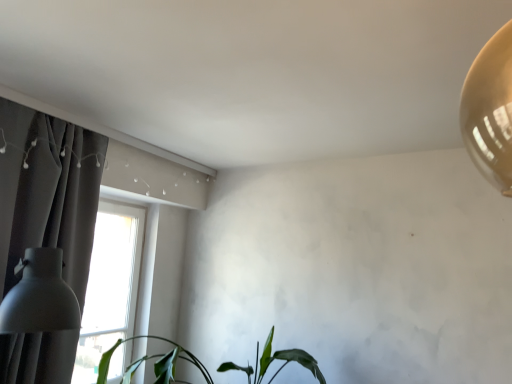
Where is `matte white lampshade at left`? The image size is (512, 384). matte white lampshade at left is located at coordinates (40, 297).

In order to click on dark gray fabric curtain at left in this screenshot , I will do [x=48, y=191].

At what (x,y) coordinates should I click in order to perform the action: click on matte white lampshade at left. Please return your answer as a coordinate pair (x, y). Looking at the image, I should click on (40, 297).

What's the angular difference between green matte plant at lower center and dark gray fabric curtain at left's facing directions?

They differ by 86.9 degrees in their facing directions.

Consider the image. Is green matte plant at lower center directly adjacent to dark gray fabric curtain at left?

green matte plant at lower center and dark gray fabric curtain at left are clearly separated.

The height and width of the screenshot is (384, 512). In order to click on houseplant to the right of dark gray fabric curtain at left in this screenshot , I will do `click(154, 364)`.

Looking at this image, is green matte plant at lower center positioned far away from matte white lampshade at left?

That's right, there is a large distance between green matte plant at lower center and matte white lampshade at left.

Is green matte plant at lower center aimed at matte white lampshade at left?

Yes, green matte plant at lower center is aimed at matte white lampshade at left.

Looking at this image, considering the sizes of green matte plant at lower center and matte white lampshade at left in the image, is green matte plant at lower center taller or shorter than matte white lampshade at left?

Clearly, green matte plant at lower center is shorter compared to matte white lampshade at left.

Is green matte plant at lower center positioned beyond the bounds of matte white lampshade at left?

Absolutely, green matte plant at lower center is external to matte white lampshade at left.

Is matte white lampshade at left oriented away from dark gray fabric curtain at left?

Yes, dark gray fabric curtain at left is at the back of matte white lampshade at left.

Considering the sizes of matte white lampshade at left and dark gray fabric curtain at left in the image, is matte white lampshade at left wider or thinner than dark gray fabric curtain at left?

In the image, matte white lampshade at left appears to be wider than dark gray fabric curtain at left.

Where is `curtain behind the matte white lampshade at left`? This screenshot has height=384, width=512. curtain behind the matte white lampshade at left is located at coordinates (48, 191).

Is matte white lampshade at left wider or thinner than green matte plant at lower center?

Considering their sizes, matte white lampshade at left looks slimmer than green matte plant at lower center.

Is matte white lampshade at left completely or partially outside of green matte plant at lower center?

That's correct, matte white lampshade at left is outside of green matte plant at lower center.

Does matte white lampshade at left have a smaller size compared to green matte plant at lower center?

Yes, matte white lampshade at left is smaller than green matte plant at lower center.

Which is behind, point (37, 297) or point (228, 364)?

The point (228, 364) is more distant.

From the picture: In terms of width, does dark gray fabric curtain at left look wider or thinner when compared to green matte plant at lower center?

In the image, dark gray fabric curtain at left appears to be more narrow than green matte plant at lower center.

From a real-world perspective, is dark gray fabric curtain at left on top of green matte plant at lower center?

Correct, in the physical world, dark gray fabric curtain at left is higher than green matte plant at lower center.

Who is more distant, dark gray fabric curtain at left or green matte plant at lower center?

Positioned behind is green matte plant at lower center.

Find the location of a particular element. The width and height of the screenshot is (512, 384). curtain located above the green matte plant at lower center (from a real-world perspective) is located at coordinates (48, 191).

From the image's perspective, does dark gray fabric curtain at left appear higher than matte white lampshade at left?

Yes, from the image's perspective, dark gray fabric curtain at left is over matte white lampshade at left.

Based on their positions, is dark gray fabric curtain at left located to the left or right of matte white lampshade at left?

Clearly, dark gray fabric curtain at left is on the left of matte white lampshade at left in the image.

Is dark gray fabric curtain at left inside or outside of matte white lampshade at left?

dark gray fabric curtain at left is outside matte white lampshade at left.

You are a GUI agent. You are given a task and a screenshot of the screen. Output one action in this format:
    pyautogui.click(x=<x>, y=<y>)
    Task: Click on the houseplant below the dark gray fabric curtain at left (from the image's perspective)
    Image resolution: width=512 pixels, height=384 pixels.
    Given the screenshot: What is the action you would take?
    pyautogui.click(x=154, y=364)

The width and height of the screenshot is (512, 384). In the image, there is a green matte plant at lower center. Find the location of `table lamp above it (from the image's perspective)`. table lamp above it (from the image's perspective) is located at coordinates pyautogui.click(x=40, y=297).

Based on their spatial positions, is dark gray fabric curtain at left or green matte plant at lower center further from matte white lampshade at left?

green matte plant at lower center lies further to matte white lampshade at left than the other object.

Estimate the real-world distances between objects in this image. Which object is further from dark gray fabric curtain at left, green matte plant at lower center or matte white lampshade at left?

Among the two, green matte plant at lower center is located further to dark gray fabric curtain at left.

From the image, which object appears to be nearer to matte white lampshade at left, green matte plant at lower center or dark gray fabric curtain at left?

Based on the image, dark gray fabric curtain at left appears to be nearer to matte white lampshade at left.

Looking at the image, which one is located closer to green matte plant at lower center, matte white lampshade at left or dark gray fabric curtain at left?

Answer: The object closer to green matte plant at lower center is matte white lampshade at left.

Considering their positions, is matte white lampshade at left positioned closer to dark gray fabric curtain at left than green matte plant at lower center?

matte white lampshade at left lies closer to dark gray fabric curtain at left than the other object.

When comparing their distances from green matte plant at lower center, does dark gray fabric curtain at left or matte white lampshade at left seem further?

dark gray fabric curtain at left is further to green matte plant at lower center.

Identify the location of table lamp between dark gray fabric curtain at left and green matte plant at lower center in the horizontal direction. (40, 297).